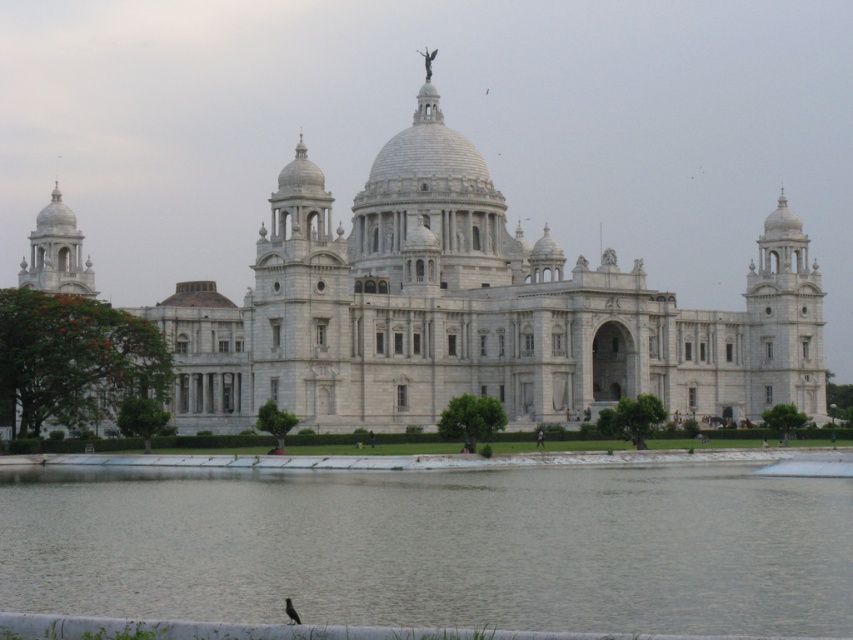
You are standing in front of the grand neoclassical building and notice two points marked on its facade. The first point is located at coordinates point (129, 483) and the second at point (291, 193). Which of these points is closer to you as you face the building?

Point (129, 483) is in front of point (291, 193), so it is closer to you as you face the building.

You are an architect visiting the site of the gray concrete water at center and the white marble palace at center. Which structure takes up more area in the image?

The white marble palace at center occupies more space than the gray concrete water at center, so the palace takes up more area in the image.